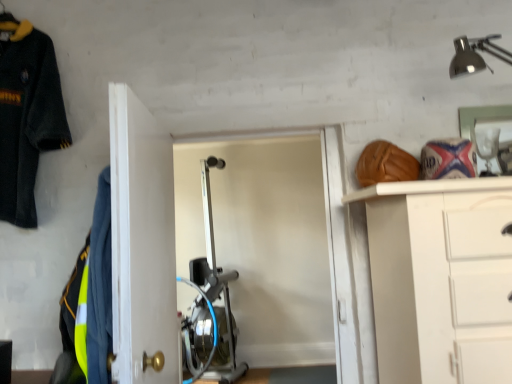
Question: Considering the positions of point (126, 211) and point (25, 26), is point (126, 211) closer or farther from the camera than point (25, 26)?

Choices:
 (A) farther
 (B) closer

Answer: (B)

Question: Looking at the image, does white glossy door at center seem bigger or smaller compared to dark blue fleece jacket at upper left, the second uniform positioned from the right?

Choices:
 (A) small
 (B) big

Answer: (B)

Question: Which object is the closest to the reflective yellow-green fabric at left, which ranks as the second uniform in left-to-right order?

Choices:
 (A) white glossy door at center
 (B) dark blue fleece jacket at upper left, marked as the 1th uniform in a top-to-bottom arrangement

Answer: (A)

Question: Estimate the real-world distances between objects in this image. Which object is closer to the reflective yellow-green fabric at left, arranged as the second uniform when viewed from the top?

Choices:
 (A) white glossy door at center
 (B) dark blue fleece jacket at upper left, the second uniform positioned from the right

Answer: (A)